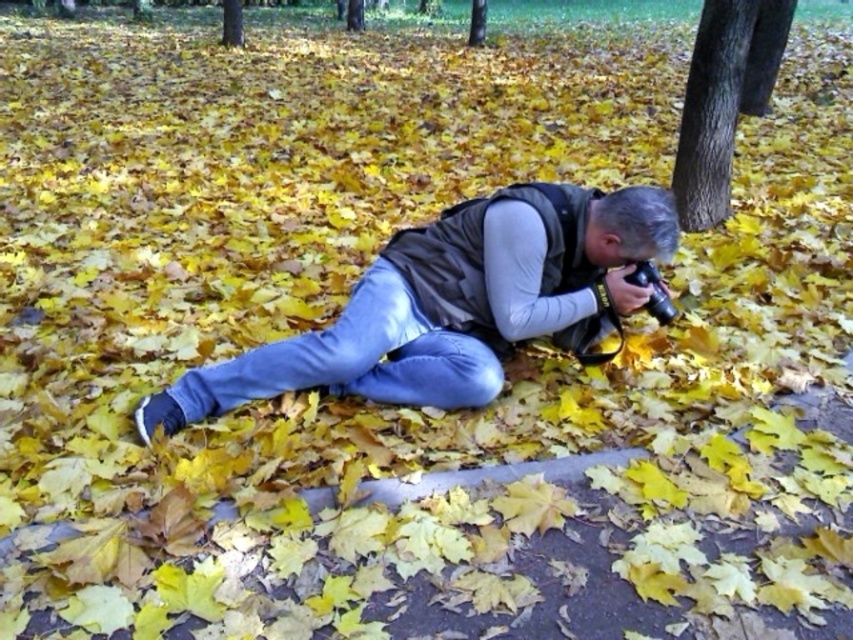
Question: Considering the relative positions of smooth bark tree at center and brown textured tree at upper center in the image provided, where is smooth bark tree at center located with respect to brown textured tree at upper center?

Choices:
 (A) left
 (B) right

Answer: (B)

Question: Which of the following is the closest to the observer?

Choices:
 (A) smooth bark tree at upper center
 (B) brown textured tree at upper center
 (C) smooth bark tree at center
 (D) denim jeans at center

Answer: (D)

Question: Which point is farther to the camera?

Choices:
 (A) (737, 35)
 (B) (469, 38)
 (C) (224, 13)
 (D) (457, 371)

Answer: (B)

Question: Which point is farther to the camera?

Choices:
 (A) brown textured tree at upper center
 (B) smooth bark tree at center
 (C) denim jeans at center

Answer: (A)

Question: Is denim jeans at center bigger than smooth bark tree at center?

Choices:
 (A) no
 (B) yes

Answer: (B)

Question: Can you confirm if smooth bark tree at center is positioned to the left of smooth bark tree at upper center?

Choices:
 (A) yes
 (B) no

Answer: (B)